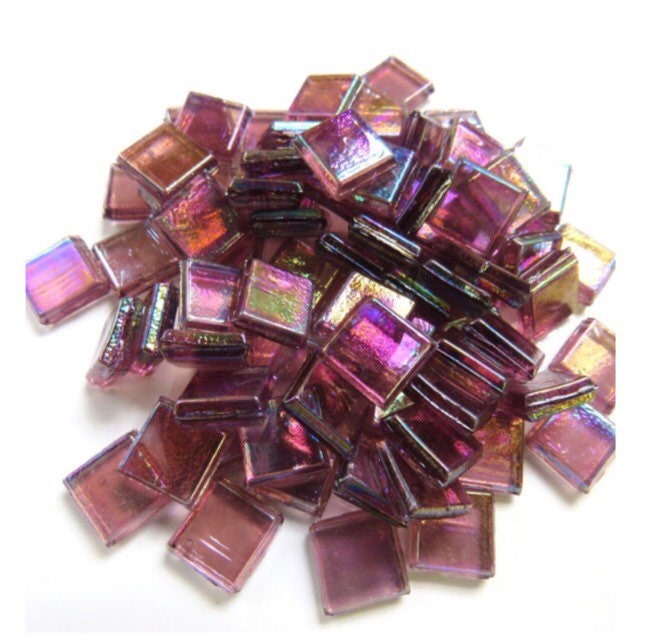
This screenshot has width=657, height=642. I want to click on small square tiles, so click(x=344, y=220).